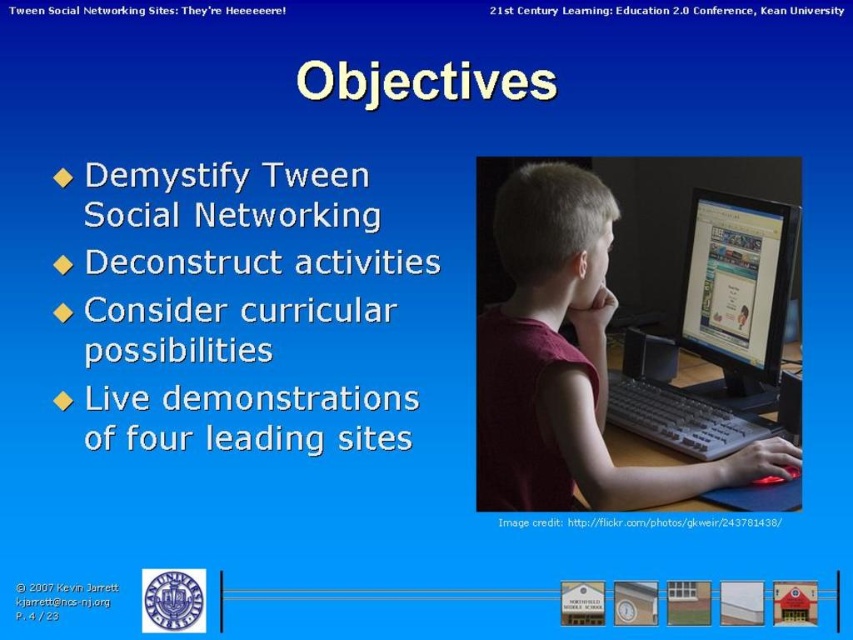
Question: Which of the following is the closest to the observer?

Choices:
 (A) matte black monitor at center
 (B) matte red shirt at center

Answer: (B)

Question: Which object is farther from the camera taking this photo?

Choices:
 (A) matte black monitor at center
 (B) matte red shirt at center

Answer: (A)

Question: Is matte red shirt at center closer to the viewer compared to matte black monitor at center?

Choices:
 (A) yes
 (B) no

Answer: (A)

Question: Does matte red shirt at center have a smaller size compared to matte black monitor at center?

Choices:
 (A) yes
 (B) no

Answer: (B)

Question: Can you confirm if matte red shirt at center is positioned below matte black monitor at center?

Choices:
 (A) yes
 (B) no

Answer: (A)